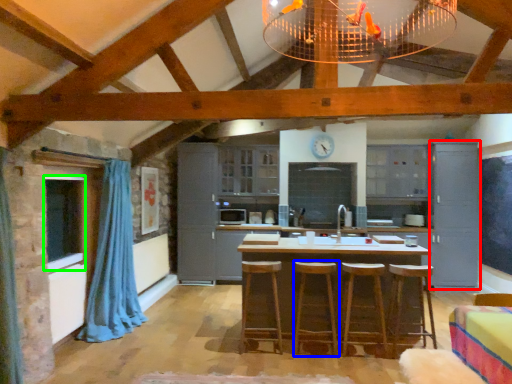
Question: Estimate the real-world distances between objects in this image. Which object is closer to cabinetry (highlighted by a red box), bar stool (highlighted by a blue box) or window (highlighted by a green box)?

Choices:
 (A) bar stool
 (B) window

Answer: (A)